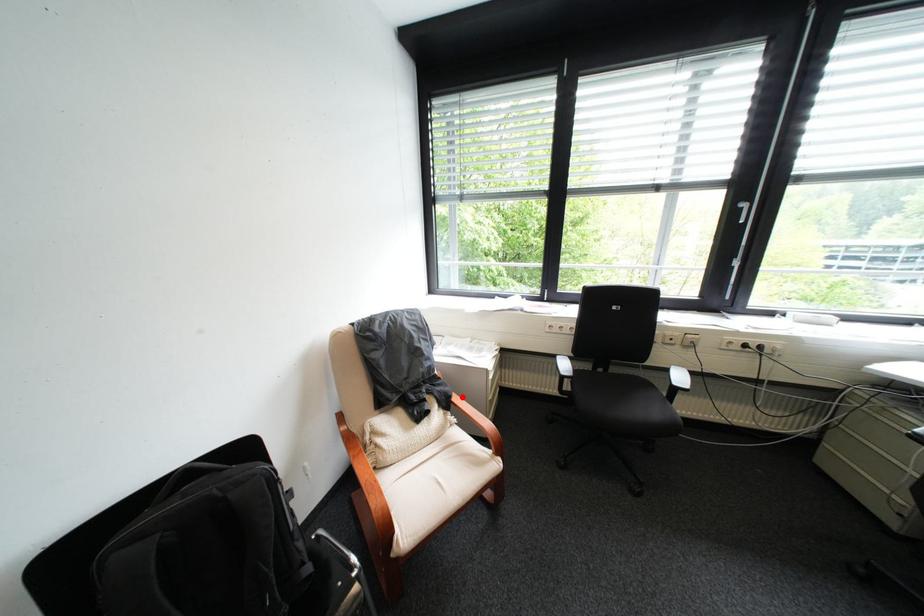
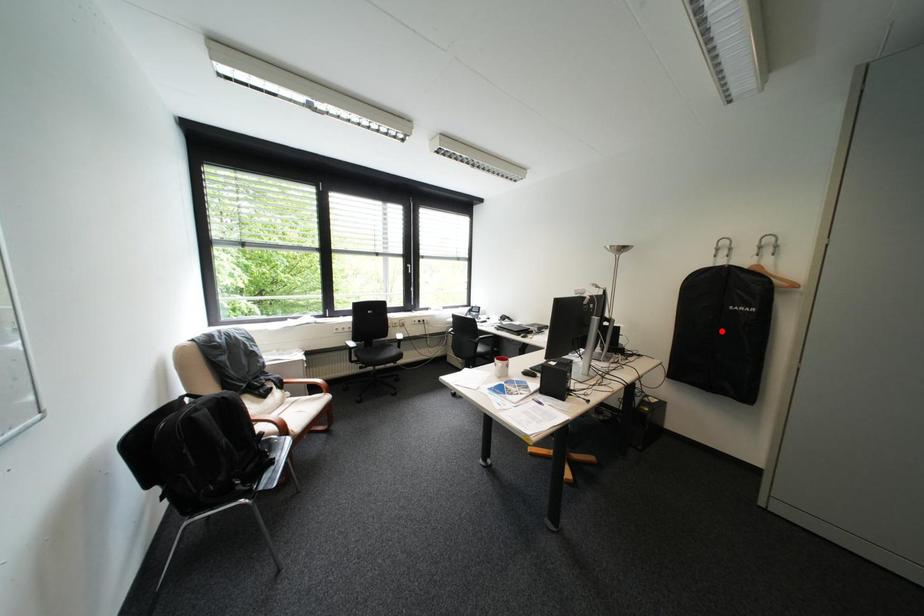
I am providing you with two images of the same scene from different viewpoints. A red point is marked on the first image and another point is marked on the second image. Are the points marked in image1 and image2 representing the same 3D position?

No